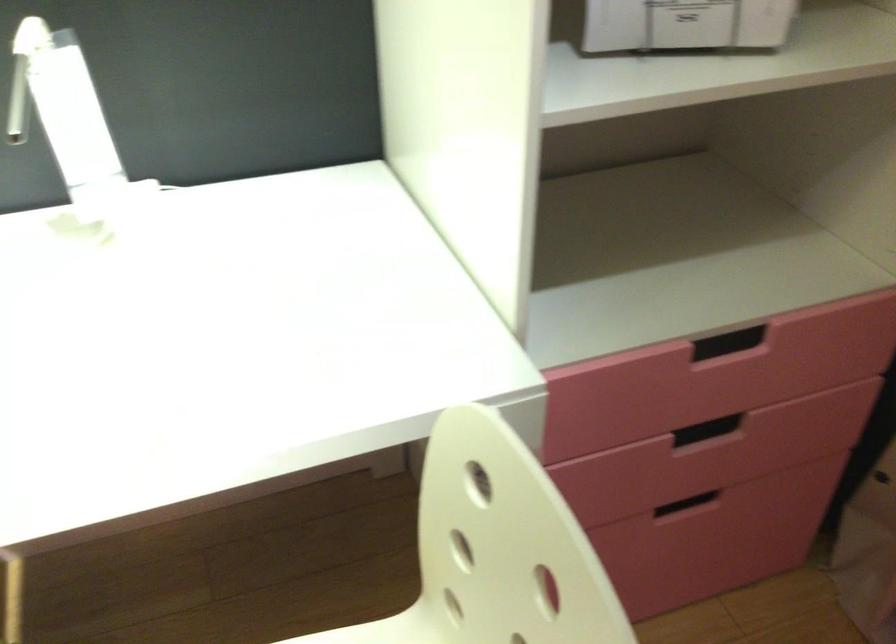
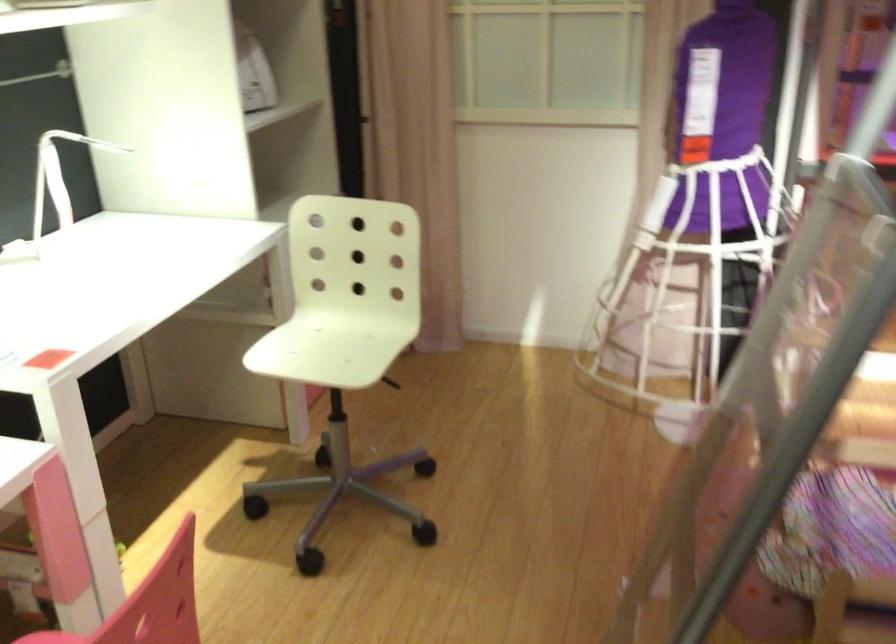
Question: I am providing you with two images of the same scene from different viewpoints. After the viewpoint changes to image2, which objects are now occluded?

Choices:
 (A) recessed drawer handle
 (B) white desk lamp
 (C) white chair sitting surface
 (D) small brochure

Answer: (A)